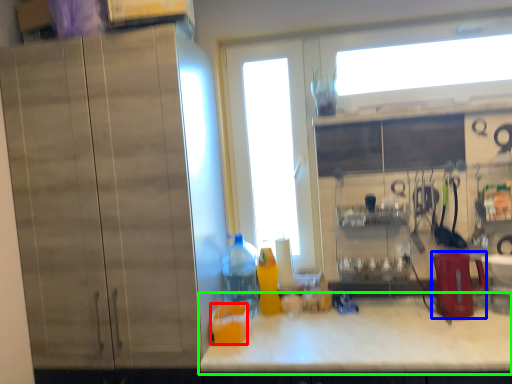
Question: Which object is the closest to the juice (highlighted by a red box)? Choose among these: appliance (highlighted by a blue box) or countertop (highlighted by a green box).

Choices:
 (A) appliance
 (B) countertop

Answer: (B)